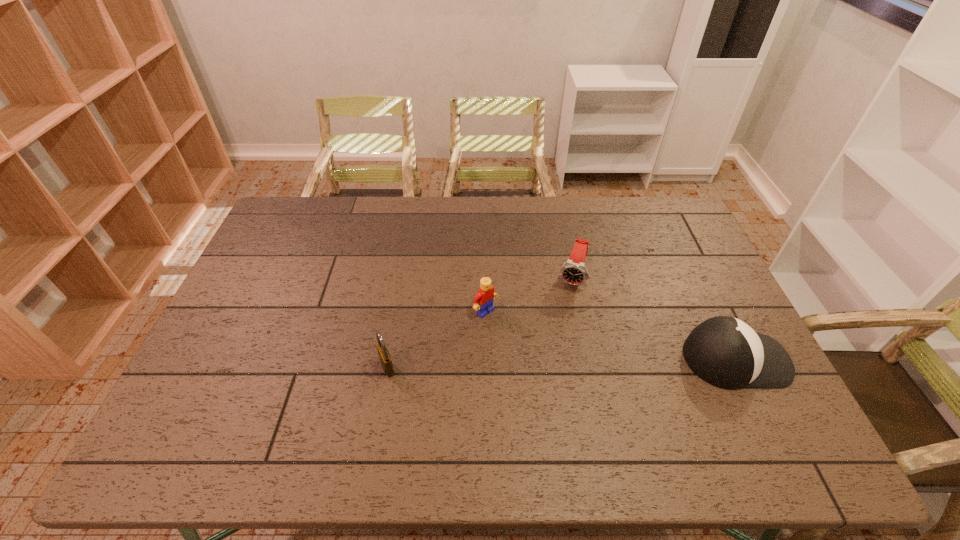
Find the location of a particular element. padlock is located at coordinates (384, 355).

Identify the location of cap. The image size is (960, 540). tap(725, 352).

At what (x,y) coordinates should I click in order to perform the action: click on the third object from right to left. Please return your answer as a coordinate pair (x, y). Image resolution: width=960 pixels, height=540 pixels. Looking at the image, I should click on (483, 300).

You are a GUI agent. You are given a task and a screenshot of the screen. Output one action in this format:
    pyautogui.click(x=<x>, y=<y>)
    Task: Click on the Lego
    The height and width of the screenshot is (540, 960).
    Given the screenshot: What is the action you would take?
    pyautogui.click(x=483, y=300)

The height and width of the screenshot is (540, 960). In order to click on the farthest object in this screenshot , I will do `click(573, 271)`.

The image size is (960, 540). In order to click on watch in this screenshot , I will do `click(573, 271)`.

This screenshot has width=960, height=540. In order to click on free space located on the left of the leftmost object in this screenshot , I will do `click(330, 367)`.

This screenshot has height=540, width=960. I want to click on vacant point located 0.150m on the face of the Lego, so click(x=531, y=349).

Locate an element on the screen. The image size is (960, 540). free space located 0.290m on the face of the Lego is located at coordinates (570, 382).

You are a GUI agent. You are given a task and a screenshot of the screen. Output one action in this format:
    pyautogui.click(x=<x>, y=<y>)
    Task: Click on the vacant area situated 0.370m on the face of the Lego
    The height and width of the screenshot is (540, 960).
    Given the screenshot: What is the action you would take?
    pyautogui.click(x=595, y=403)